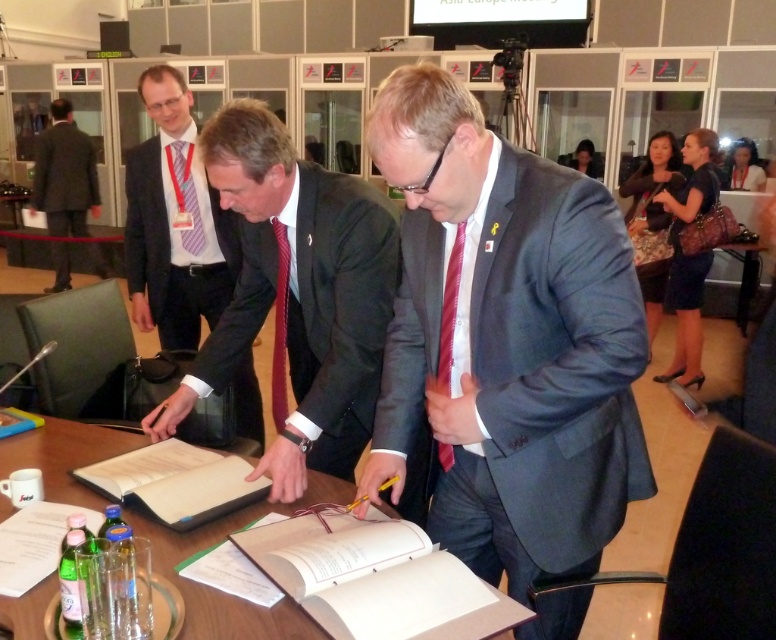
You are a photographer at the signing ceremony. You need to position your camera so that both point (133,150) and point (54,221) are in focus. Which point should you focus on first to ensure both are sharp?

You should focus on point (133,150) first because it is closer to the viewer than point (54,221), ensuring the depth of field captures both points.

You are a photographer standing at the back of the room. You need to take a photo of the dark gray suit at upper left and ensure they are all in focus. The camera you are using has a depth of field that can cover 8 feet. Will you be able to capture all of them in focus?

The dark gray suit at upper left are 9.20 feet apart, which exceeds the camera depth of field of 8 feet. Therefore, not all of them will be in focus in the photo.

You are a photographer at a formal event. You need to capture a photo of the dark gray suit at left and the red silk tie at center. Based on their positions, which one is covering part of the other?

The dark gray suit at left is positioned over the red silk tie at center, so it is covering part of it.